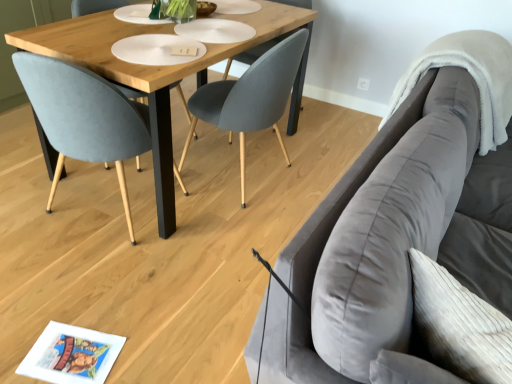
Where is `vacant space in front of matte gray chair at center, the 1th chair in the right-to-left sequence`? The image size is (512, 384). vacant space in front of matte gray chair at center, the 1th chair in the right-to-left sequence is located at coordinates (226, 243).